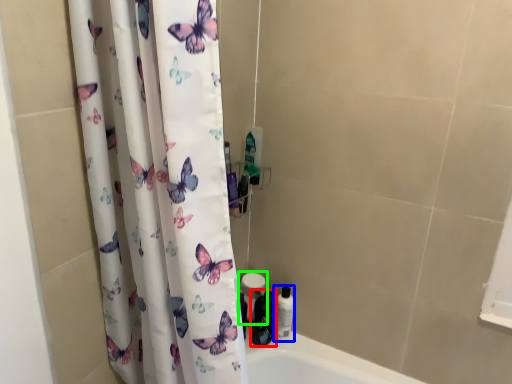
Question: Which object is the closest to the toiletry (highlighted by a red box)? Choose among these: toiletry (highlighted by a blue box) or toilet paper (highlighted by a green box).

Choices:
 (A) toiletry
 (B) toilet paper

Answer: (A)